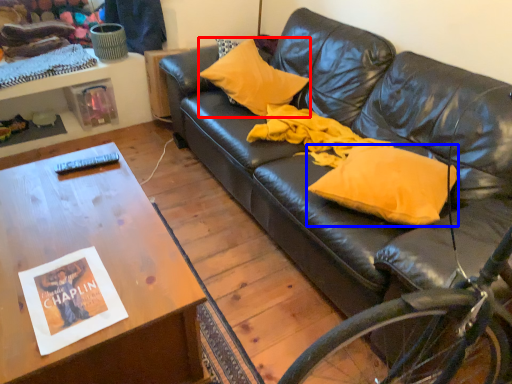
Question: Which object is closer to the camera taking this photo, pillow (highlighted by a red box) or pillow (highlighted by a blue box)?

Choices:
 (A) pillow
 (B) pillow

Answer: (B)